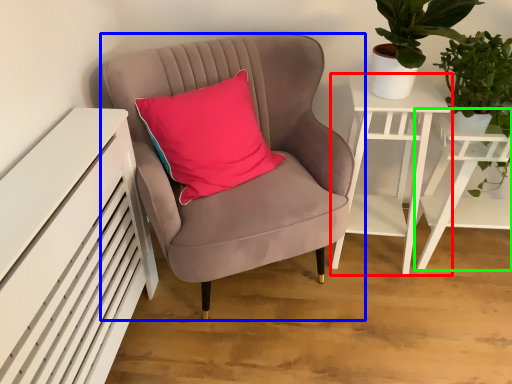
Question: Estimate the real-world distances between objects in this image. Which object is farther from nightstand (highlighted by a red box), chair (highlighted by a blue box) or table (highlighted by a green box)?

Choices:
 (A) chair
 (B) table

Answer: (A)